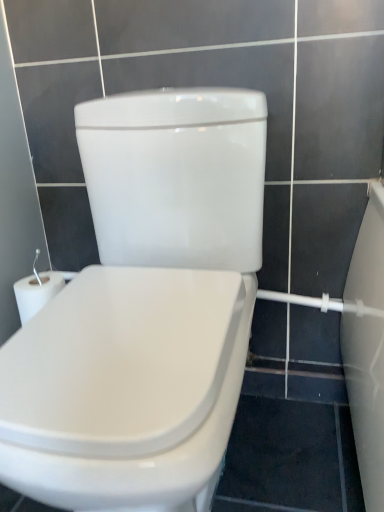
Measure the distance between point [58,461] and camera.

The depth of point [58,461] is 19.96 inches.

This screenshot has width=384, height=512. What do you see at coordinates (125, 387) in the screenshot? I see `white glossy bidet at center` at bounding box center [125, 387].

What is the approximate height of white glossy bidet at center?

It is 31.69 inches.

In order to face white glossy bidet at center, should I rotate leftwards or rightwards?

A 6.847 degree turn to the left will do.

This screenshot has height=512, width=384. I want to click on white glossy bidet at center, so click(x=125, y=387).

You are a GUI agent. You are given a task and a screenshot of the screen. Output one action in this format:
    pyautogui.click(x=<x>, y=<y>)
    Task: Click on the white glossy bidet at center
    The width and height of the screenshot is (384, 512).
    Given the screenshot: What is the action you would take?
    pyautogui.click(x=125, y=387)